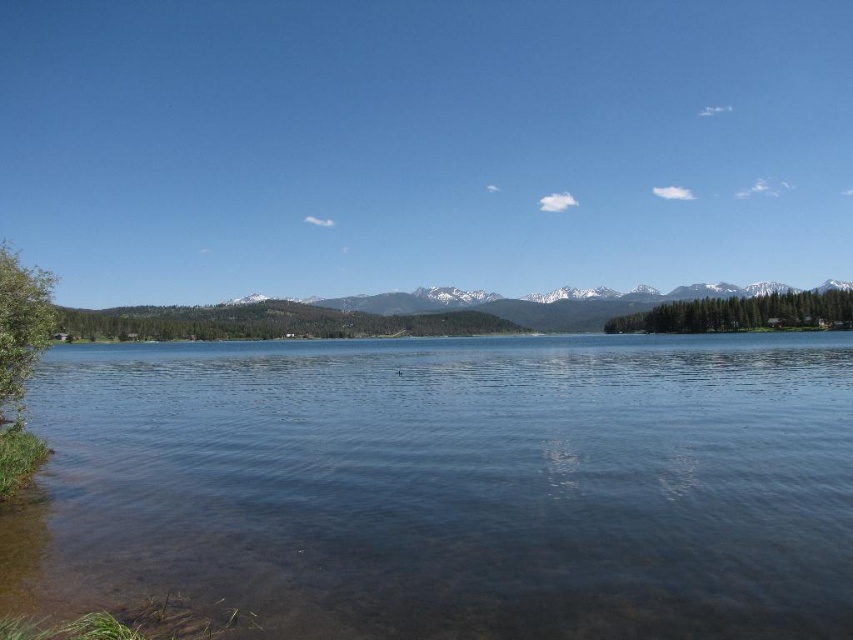
Question: Is clear water at lower left above snowy white mountain at center?

Choices:
 (A) no
 (B) yes

Answer: (A)

Question: Does clear water at lower left come behind snowy white mountain at center?

Choices:
 (A) no
 (B) yes

Answer: (A)

Question: Which point is closer to the camera taking this photo?

Choices:
 (A) (444, 308)
 (B) (45, 410)

Answer: (B)

Question: Does clear water at lower left appear under snowy white mountain at center?

Choices:
 (A) yes
 (B) no

Answer: (A)